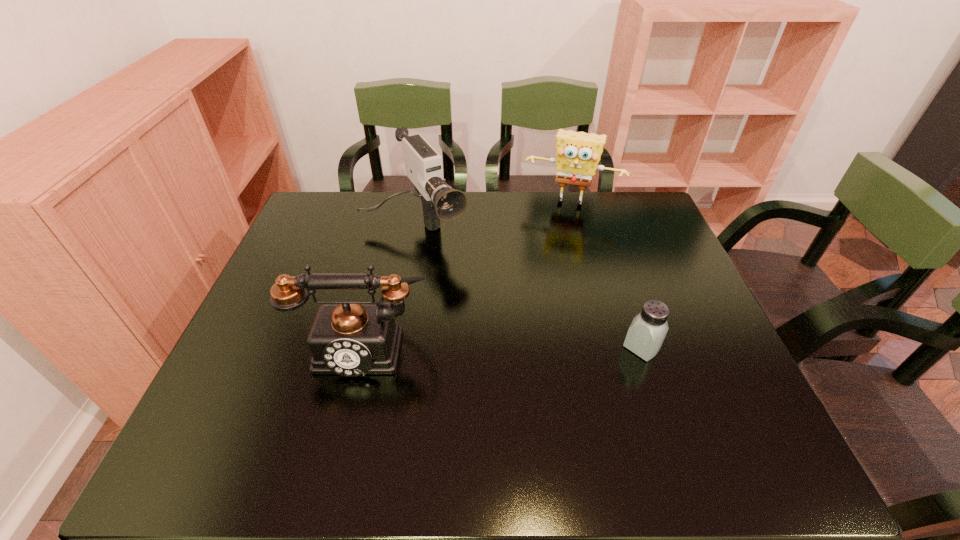
Identify the location of vacant space that is in between the shortest object and the telephone. (503, 346).

This screenshot has width=960, height=540. I want to click on free space that is in between the sponge and the telephone, so click(x=468, y=273).

Where is `object that is the nearest to the telephone`? object that is the nearest to the telephone is located at coordinates (423, 164).

Identify which object is the second nearest to the saltshaker. Please provide its 2D coordinates. Your answer should be formatted as a tuple, i.e. [(x, y)], where the tuple contains the x and y coordinates of a point satisfying the conditions above.

[(423, 164)]

You are a GUI agent. You are given a task and a screenshot of the screen. Output one action in this format:
    pyautogui.click(x=<x>, y=<y>)
    Task: Click on the vacant region that satisfies the following two spatial constraints: 1. on the front side of the camcorder; 2. on the right side of the saltshaker
    
    Given the screenshot: What is the action you would take?
    pyautogui.click(x=394, y=347)

This screenshot has width=960, height=540. Identify the location of vacant space that satisfies the following two spatial constraints: 1. on the front side of the camcorder; 2. on the left side of the saltshaker. pyautogui.click(x=394, y=347).

The height and width of the screenshot is (540, 960). In order to click on blank area in the image that satisfies the following two spatial constraints: 1. on the front side of the camcorder; 2. on the left side of the shortest object in this screenshot , I will do `click(394, 347)`.